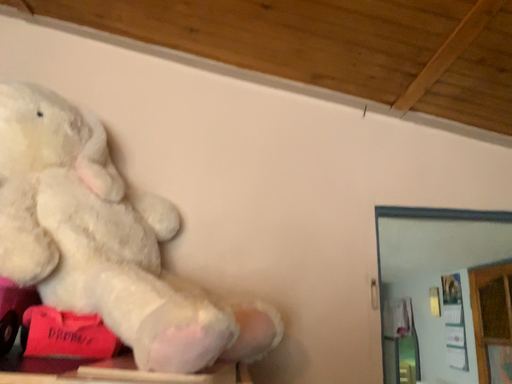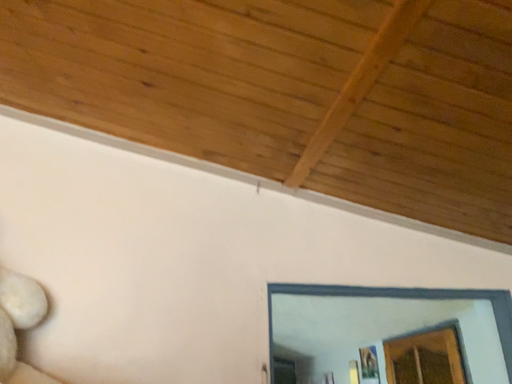
Question: How did the camera likely rotate when shooting the video?

Choices:
 (A) rotated downward
 (B) rotated upward

Answer: (B)